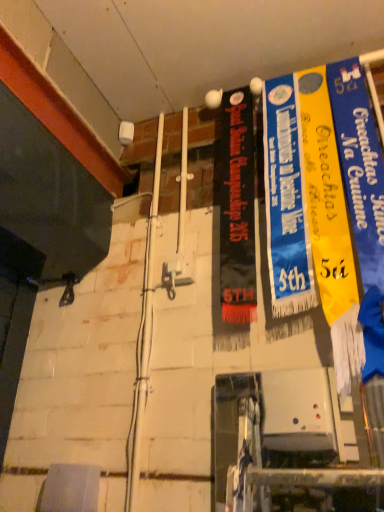
How much space does yellow fabric banner at right, which is counted as the second poster, starting from the left, occupy vertically?

It is 39.28 inches.

Measure the distance between point (350, 240) and camera.

The depth of point (350, 240) is 1.07 meters.

What do you see at coordinates (326, 198) in the screenshot?
I see `yellow fabric banner at right, which is counted as the second poster, starting from the left` at bounding box center [326, 198].

The width and height of the screenshot is (384, 512). What are the coordinates of `yellow fabric banner at right, which is counted as the second poster, starting from the left` in the screenshot? It's located at (326, 198).

What is the approximate width of blue fabric banner at center, the 2th poster when ordered from right to left?

A: The width of blue fabric banner at center, the 2th poster when ordered from right to left, is 2.06 inches.

Locate an element on the screen. The image size is (384, 512). blue fabric banner at center, the 2th poster when ordered from right to left is located at coordinates (286, 201).

Describe the element at coordinates (286, 201) in the screenshot. I see `blue fabric banner at center, the first poster from the left` at that location.

At what (x,y) coordinates should I click in order to perform the action: click on yellow fabric banner at right, which is counted as the second poster, starting from the left. Please return your answer as a coordinate pair (x, y). Looking at the image, I should click on click(326, 198).

Is blue fabric banner at center, the 2th poster when ordered from right to left, to the left of yellow fabric banner at right, which is counted as the second poster, starting from the left, from the viewer's perspective?

Yes.

Considering their positions, is blue fabric banner at center, the 2th poster when ordered from right to left, located in front of or behind yellow fabric banner at right, which is counted as the second poster, starting from the left?

In the image, blue fabric banner at center, the 2th poster when ordered from right to left, appears behind yellow fabric banner at right, which is counted as the second poster, starting from the left.

Which point is more distant from viewer, (265, 90) or (320, 241)?

The point (265, 90) is more distant.

From the image's perspective, which one is positioned higher, blue fabric banner at center, the 2th poster when ordered from right to left, or yellow fabric banner at right, which is counted as the second poster, starting from the left?

blue fabric banner at center, the 2th poster when ordered from right to left.

From a real-world perspective, is blue fabric banner at center, the 2th poster when ordered from right to left, physically located above or below yellow fabric banner at right, the 1th poster positioned from the right?

Clearly, from a real-world perspective, blue fabric banner at center, the 2th poster when ordered from right to left, is above yellow fabric banner at right, the 1th poster positioned from the right.

Considering the sizes of objects blue fabric banner at center, the first poster from the left, and yellow fabric banner at right, which is counted as the second poster, starting from the left, in the image provided, who is thinner, blue fabric banner at center, the first poster from the left, or yellow fabric banner at right, which is counted as the second poster, starting from the left,?

blue fabric banner at center, the first poster from the left.

In terms of height, does blue fabric banner at center, the 2th poster when ordered from right to left, look taller or shorter compared to yellow fabric banner at right, which is counted as the second poster, starting from the left?

In the image, blue fabric banner at center, the 2th poster when ordered from right to left, appears to be shorter than yellow fabric banner at right, which is counted as the second poster, starting from the left.

Between blue fabric banner at center, the first poster from the left, and yellow fabric banner at right, which is counted as the second poster, starting from the left, which one has larger size?

yellow fabric banner at right, which is counted as the second poster, starting from the left.

Would you say yellow fabric banner at right, which is counted as the second poster, starting from the left, is part of blue fabric banner at center, the 2th poster when ordered from right to left,'s contents?

No, blue fabric banner at center, the 2th poster when ordered from right to left, does not contain yellow fabric banner at right, which is counted as the second poster, starting from the left.

Are blue fabric banner at center, the 2th poster when ordered from right to left, and yellow fabric banner at right, which is counted as the second poster, starting from the left, far apart?

Actually, blue fabric banner at center, the 2th poster when ordered from right to left, and yellow fabric banner at right, which is counted as the second poster, starting from the left, are a little close together.

Looking at this image, is blue fabric banner at center, the first poster from the left, facing away from yellow fabric banner at right, the 1th poster positioned from the right?

blue fabric banner at center, the first poster from the left, is not turned away from yellow fabric banner at right, the 1th poster positioned from the right.

Could you measure the distance between blue fabric banner at center, the first poster from the left, and yellow fabric banner at right, which is counted as the second poster, starting from the left?

6.04 centimeters.

Find the location of a particular element. This screenshot has width=384, height=512. poster above the yellow fabric banner at right, which is counted as the second poster, starting from the left (from a real-world perspective) is located at coordinates (286, 201).

Is yellow fabric banner at right, which is counted as the second poster, starting from the left, to the right of blue fabric banner at center, the first poster from the left, from the viewer's perspective?

Yes, yellow fabric banner at right, which is counted as the second poster, starting from the left, is to the right of blue fabric banner at center, the first poster from the left.

Who is more distant, yellow fabric banner at right, the 1th poster positioned from the right, or blue fabric banner at center, the 2th poster when ordered from right to left?

blue fabric banner at center, the 2th poster when ordered from right to left, is more distant.

Is point (334, 311) closer to camera compared to point (274, 170)?

Yes, point (334, 311) is in front of point (274, 170).

In the scene shown: From the image's perspective, is yellow fabric banner at right, the 1th poster positioned from the right, under blue fabric banner at center, the 2th poster when ordered from right to left?

Indeed, from the image's perspective, yellow fabric banner at right, the 1th poster positioned from the right, is shown beneath blue fabric banner at center, the 2th poster when ordered from right to left.

From a real-world perspective, is yellow fabric banner at right, the 1th poster positioned from the right, positioned under blue fabric banner at center, the 2th poster when ordered from right to left, based on gravity?

Indeed, from a real-world perspective, yellow fabric banner at right, the 1th poster positioned from the right, is positioned beneath blue fabric banner at center, the 2th poster when ordered from right to left.

Consider the image. Between yellow fabric banner at right, which is counted as the second poster, starting from the left, and blue fabric banner at center, the first poster from the left, which one has smaller width?

Thinner between the two is blue fabric banner at center, the first poster from the left.

Is yellow fabric banner at right, which is counted as the second poster, starting from the left, shorter than blue fabric banner at center, the first poster from the left?

No, yellow fabric banner at right, which is counted as the second poster, starting from the left, is not shorter than blue fabric banner at center, the first poster from the left.

Considering the relative sizes of yellow fabric banner at right, which is counted as the second poster, starting from the left, and blue fabric banner at center, the first poster from the left, in the image provided, is yellow fabric banner at right, which is counted as the second poster, starting from the left, bigger than blue fabric banner at center, the first poster from the left,?

Correct, yellow fabric banner at right, which is counted as the second poster, starting from the left, is larger in size than blue fabric banner at center, the first poster from the left.

Is yellow fabric banner at right, the 1th poster positioned from the right, surrounding blue fabric banner at center, the 2th poster when ordered from right to left?

Definitely not — blue fabric banner at center, the 2th poster when ordered from right to left, is not inside yellow fabric banner at right, the 1th poster positioned from the right.

Is yellow fabric banner at right, the 1th poster positioned from the right, in contact with blue fabric banner at center, the first poster from the left?

Yes, yellow fabric banner at right, the 1th poster positioned from the right, is right next to blue fabric banner at center, the first poster from the left, and making contact.

Is yellow fabric banner at right, the 1th poster positioned from the right, oriented towards blue fabric banner at center, the 2th poster when ordered from right to left?

No, yellow fabric banner at right, the 1th poster positioned from the right, is not aimed at blue fabric banner at center, the 2th poster when ordered from right to left.

Can you tell me how much yellow fabric banner at right, which is counted as the second poster, starting from the left, and blue fabric banner at center, the 2th poster when ordered from right to left, differ in facing direction?

They differ by 5.18 degrees in their facing directions.

Could you measure the distance between yellow fabric banner at right, the 1th poster positioned from the right, and blue fabric banner at center, the first poster from the left?

yellow fabric banner at right, the 1th poster positioned from the right, is 2.38 inches from blue fabric banner at center, the first poster from the left.

In the image, there is a blue fabric banner at center, the 2th poster when ordered from right to left. Identify the location of poster below it (from the image's perspective). Image resolution: width=384 pixels, height=512 pixels. (326, 198).

Locate an element on the screen. The image size is (384, 512). poster behind the yellow fabric banner at right, the 1th poster positioned from the right is located at coordinates (286, 201).

Where is `poster below the blue fabric banner at center, the first poster from the left (from a real-world perspective)`? poster below the blue fabric banner at center, the first poster from the left (from a real-world perspective) is located at coordinates (326, 198).